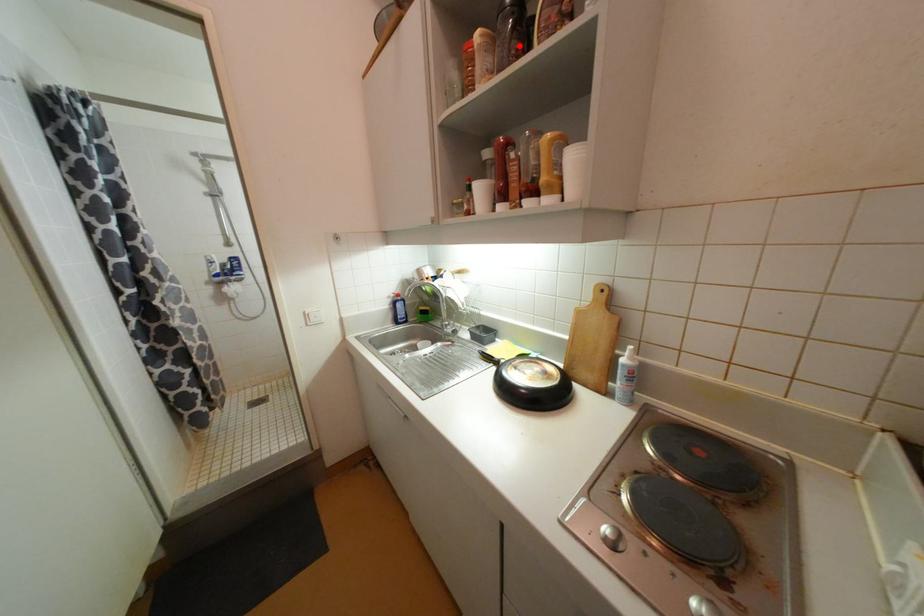
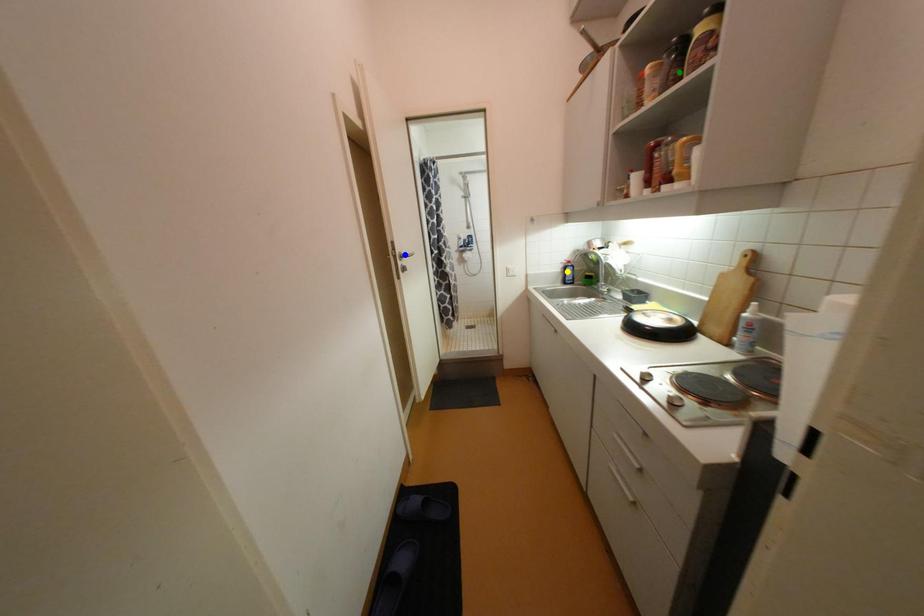
Question: I am providing you with two images of the same scene from different viewpoints. A red point is marked on the first image. You are given multiple points on the second image. Which point in image 2 is actually the same real-world point as the red point in image 1?

Choices:
 (A) yellow point
 (B) blue point
 (C) green point

Answer: (C)